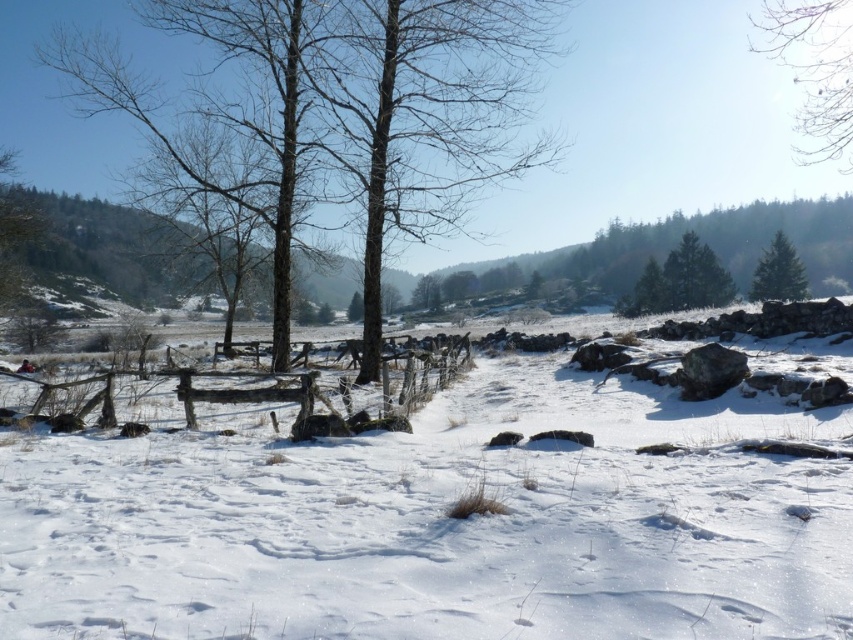
Is bare branches at upper right closer to the viewer compared to green matte trees at upper center?

Yes, bare branches at upper right is closer to the viewer.

Identify the location of bare branches at upper right. The image size is (853, 640). (814, 68).

Is white fluffy snow at center further to camera compared to bare branches at upper right?

No, it is not.

What do you see at coordinates (438, 522) in the screenshot?
I see `white fluffy snow at center` at bounding box center [438, 522].

Locate an element on the screen. white fluffy snow at center is located at coordinates (438, 522).

The width and height of the screenshot is (853, 640). Describe the element at coordinates (680, 282) in the screenshot. I see `green matte trees at upper center` at that location.

Measure the distance between green matte trees at upper center and green matte evergreen tree at upper right.

15.51 feet

The height and width of the screenshot is (640, 853). I want to click on green matte trees at upper center, so click(680, 282).